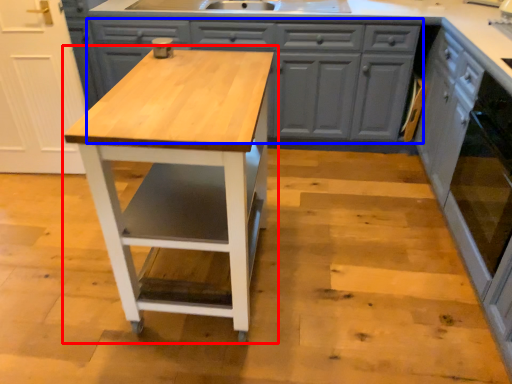
Question: Which object is closer to the camera taking this photo, table (highlighted by a red box) or cabinetry (highlighted by a blue box)?

Choices:
 (A) table
 (B) cabinetry

Answer: (A)